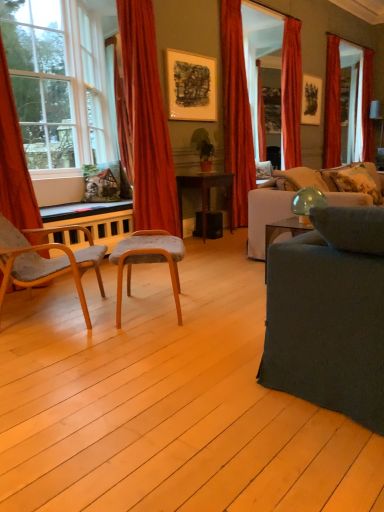
At what (x,y) coordinates should I click in order to perform the action: click on empty space that is ontop of matte black picture frame at upper center, which is counted as the 1th picture frame, starting from the left. Please return your answer as a coordinate pair (x, y). Looking at the image, I should click on (193, 54).